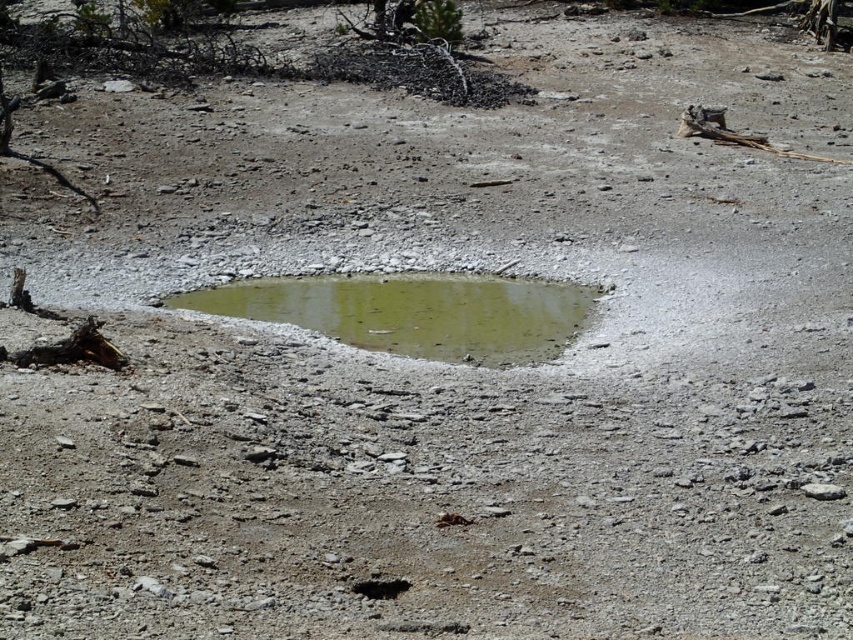
You are standing in the middle of the rocky terrain and want to walk towards the point that is closer to you. Which point should you head towards, point (511, 337) or point (364, 584)?

You should head towards point (364, 584) because it is closer to you than point (511, 337).